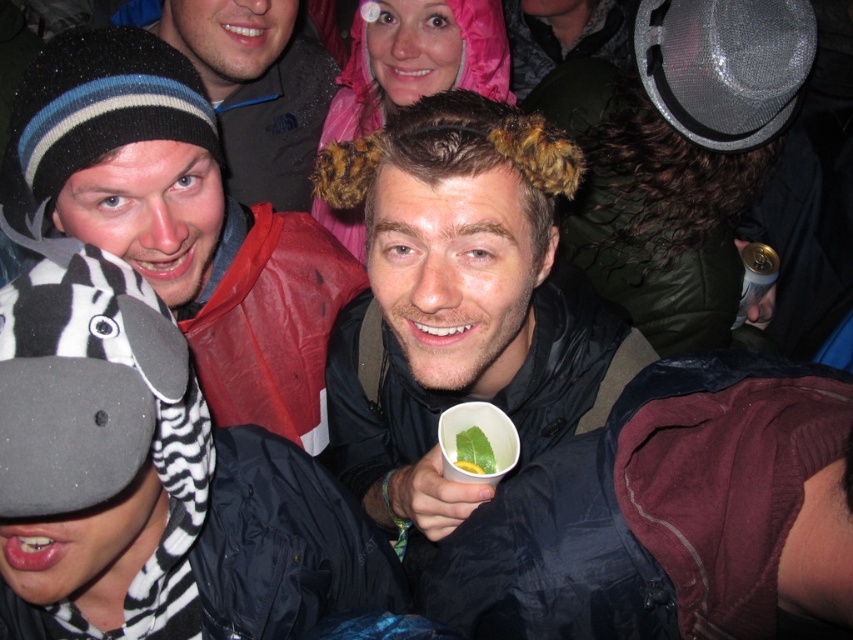
Which is behind, point (544, 332) or point (277, 83)?

Point (277, 83)

The image size is (853, 640). I want to click on fuzzy brown hat at center, so click(461, 301).

Which is behind, point (334, 248) or point (746, 256)?

The point (746, 256) is more distant.

Can you confirm if zebra-patterned plush toy at left is shorter than gold metallic can at upper right?

No, zebra-patterned plush toy at left is not shorter than gold metallic can at upper right.

Measure the distance between zebra-patterned plush toy at left and camera.

zebra-patterned plush toy at left and camera are 1.01 meters apart from each other.

Where is `zebra-patterned plush toy at left`? The width and height of the screenshot is (853, 640). zebra-patterned plush toy at left is located at coordinates (183, 221).

Between point (312, 145) and point (462, 442), which one is positioned behind?

The point (312, 145) is behind.

Find the location of a particular element. matte black jacket at upper left is located at coordinates (254, 88).